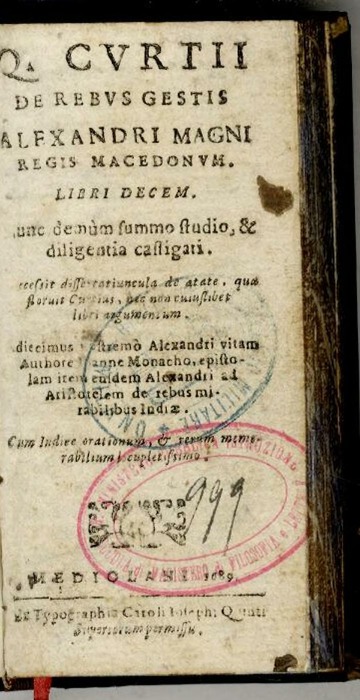
Locate an element on the screen. The image size is (360, 700). table is located at coordinates (175, 692).